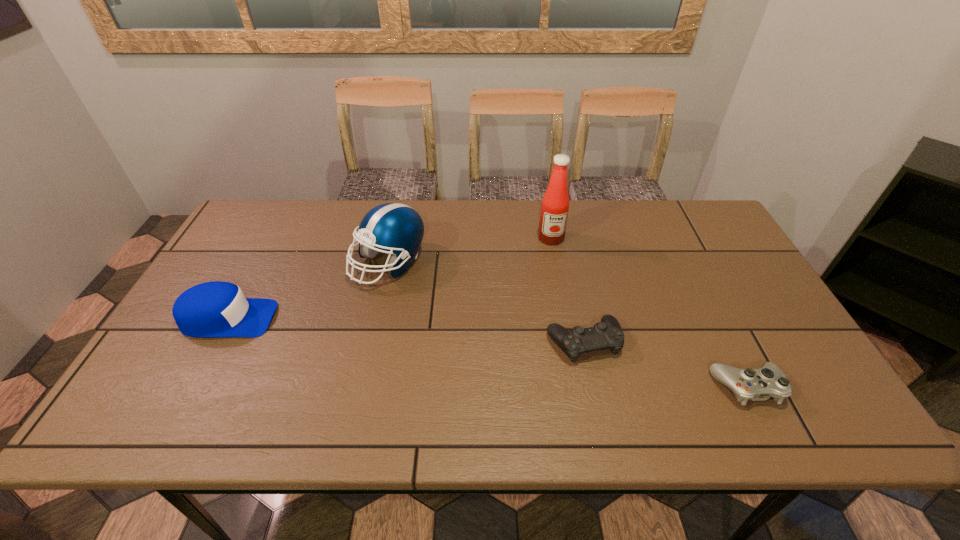
The image size is (960, 540). What are the coordinates of `empty location between the left control and the tallest object` in the screenshot? It's located at (567, 290).

Find the location of `empty space that is in between the third tallest object and the left control`. empty space that is in between the third tallest object and the left control is located at coordinates (406, 330).

The height and width of the screenshot is (540, 960). Find the location of `empty location between the football helmet and the condiment`. empty location between the football helmet and the condiment is located at coordinates (469, 251).

I want to click on vacant space in between the nearer control and the second object from left to right, so click(x=568, y=325).

The height and width of the screenshot is (540, 960). In order to click on free spot between the tallest object and the farther control in this screenshot , I will do `click(567, 290)`.

The image size is (960, 540). I want to click on object that is the fourth closest to the right control, so click(212, 309).

The image size is (960, 540). What are the coordinates of `the closest object to the third tallest object` in the screenshot? It's located at (394, 227).

I want to click on vacant space that satisfies the following two spatial constraints: 1. at the front of the football helmet with the faceguard; 2. on the left side of the farther control, so click(x=372, y=342).

Where is `free space that satisfies the following two spatial constraints: 1. on the back side of the right control; 2. on the front-facing side of the leftmost object`? The image size is (960, 540). free space that satisfies the following two spatial constraints: 1. on the back side of the right control; 2. on the front-facing side of the leftmost object is located at coordinates (713, 319).

The image size is (960, 540). What are the coordinates of `free space that satisfies the following two spatial constraints: 1. at the front of the second object from left to right with the faceguard; 2. on the left side of the nearer control` in the screenshot? It's located at (361, 387).